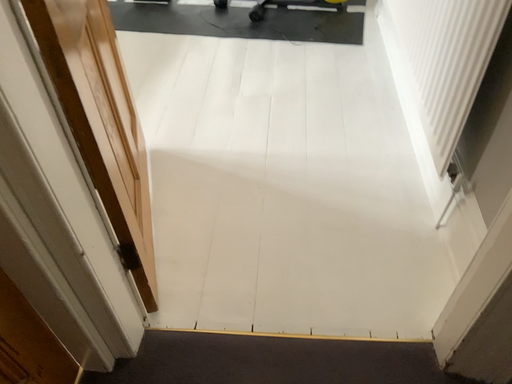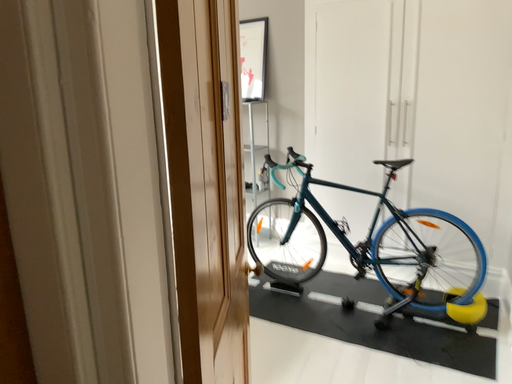
Question: Which way did the camera rotate in the video?

Choices:
 (A) rotated downward
 (B) rotated upward

Answer: (B)